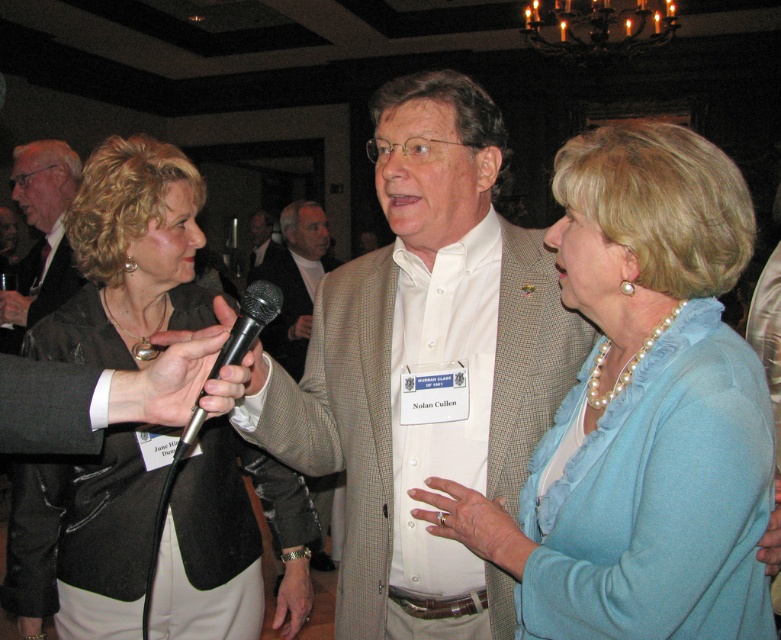
Between black suit jacket at upper left and light brown textured blazer at center, which one is positioned higher?

black suit jacket at upper left is higher up.

You are a GUI agent. You are given a task and a screenshot of the screen. Output one action in this format:
    pyautogui.click(x=<x>, y=<y>)
    Task: Click on the black suit jacket at upper left
    This screenshot has height=640, width=781.
    Given the screenshot: What is the action you would take?
    pyautogui.click(x=41, y=234)

Between black leather jacket at left and black plastic microphone at center, which one is positioned higher?

Positioned higher is black plastic microphone at center.

Does black leather jacket at left appear on the left side of black plastic microphone at center?

Correct, you'll find black leather jacket at left to the left of black plastic microphone at center.

Is point (284, 605) positioned in front of point (255, 280)?

Yes, it is.

The image size is (781, 640). Find the location of `black leather jacket at left`. black leather jacket at left is located at coordinates (129, 257).

Does point (296, 588) come in front of point (27, 160)?

Yes, point (296, 588) is in front of point (27, 160).

Does black leather jacket at left have a smaller size compared to black suit jacket at upper left?

Yes.

Is point (29, 340) farther from viewer compared to point (34, 284)?

No, (29, 340) is in front of (34, 284).

At what (x,y) coordinates should I click in order to perform the action: click on black leather jacket at left. Please return your answer as a coordinate pair (x, y). This screenshot has width=781, height=640. Looking at the image, I should click on (129, 257).